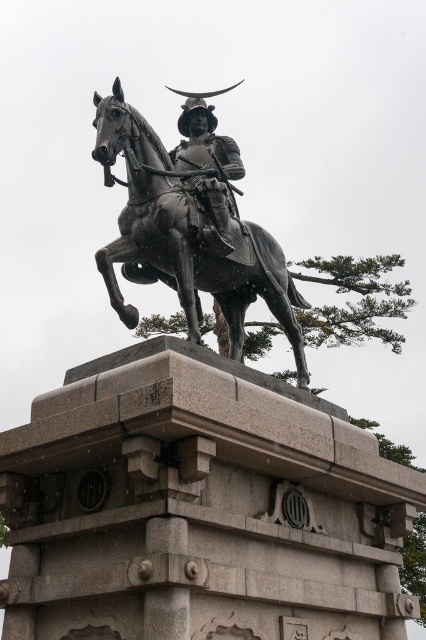
You are an art conservator examining the bronze statue of a mounted warrior. You notice a specific point at coordinates (189, 228). What object does this point correspond to?

The point at coordinates (189, 228) corresponds to the shiny black horse at center.